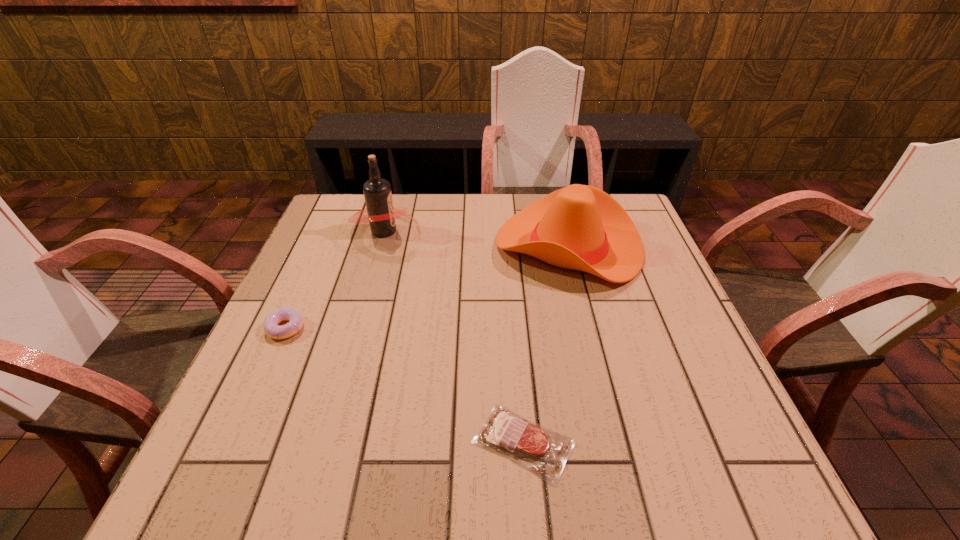
Where is `vacant space that is in between the cowboy hat and the leftmost object`? vacant space that is in between the cowboy hat and the leftmost object is located at coordinates (x=427, y=287).

Where is `vacant region between the cowboy hat and the doughnut`? vacant region between the cowboy hat and the doughnut is located at coordinates (427, 287).

This screenshot has height=540, width=960. I want to click on vacant space in between the cowboy hat and the shortest object, so click(x=546, y=344).

The width and height of the screenshot is (960, 540). What are the coordinates of `free space between the second object from left to right and the doughnut` in the screenshot? It's located at (335, 279).

The image size is (960, 540). Find the location of `blank region between the cowboy hat and the nearest object`. blank region between the cowboy hat and the nearest object is located at coordinates (546, 344).

Identify which object is located as the nearest to the tallest object. Please provide its 2D coordinates. Your answer should be formatted as a tuple, i.e. [(x, y)], where the tuple contains the x and y coordinates of a point satisfying the conditions above.

[(579, 227)]

Select which object appears as the closest to the second shortest object. Please provide its 2D coordinates. Your answer should be formatted as a tuple, i.e. [(x, y)], where the tuple contains the x and y coordinates of a point satisfying the conditions above.

[(381, 216)]

Locate an element on the screen. The width and height of the screenshot is (960, 540). free space that satisfies the following two spatial constraints: 1. on the back side of the steak; 2. on the label of the root beer is located at coordinates (507, 231).

Locate an element on the screen. free spot that satisfies the following two spatial constraints: 1. on the label of the steak; 2. on the left side of the tallest object is located at coordinates (325, 442).

This screenshot has width=960, height=540. I want to click on free space that satisfies the following two spatial constraints: 1. on the label of the cowboy hat; 2. on the right side of the root beer, so click(381, 246).